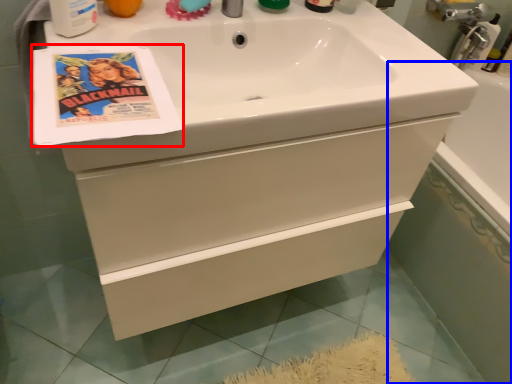
Question: Which object appears farthest to the camera in this image, flyer (highlighted by a red box) or bath (highlighted by a blue box)?

Choices:
 (A) flyer
 (B) bath

Answer: (B)